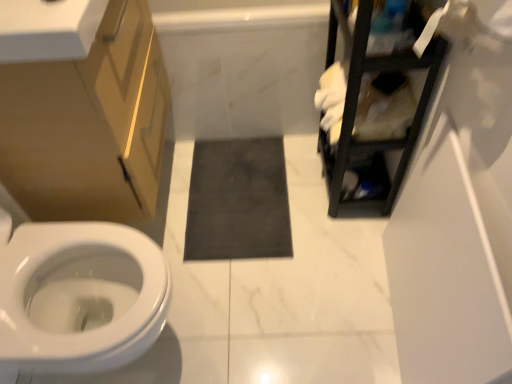
Identify the location of vacant area that is in front of dark gray matte bath mat at center. (261, 306).